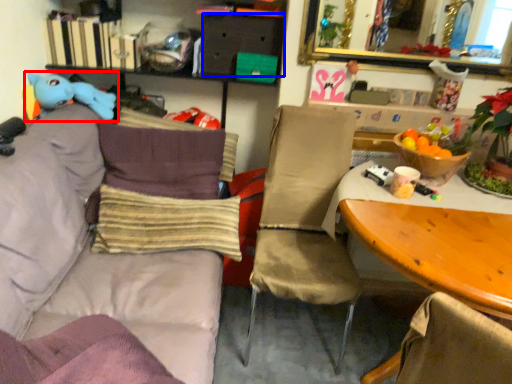
Question: Among these objects, which one is nearest to the camera, toy (highlighted by a red box) or drawer (highlighted by a blue box)?

Choices:
 (A) toy
 (B) drawer

Answer: (A)